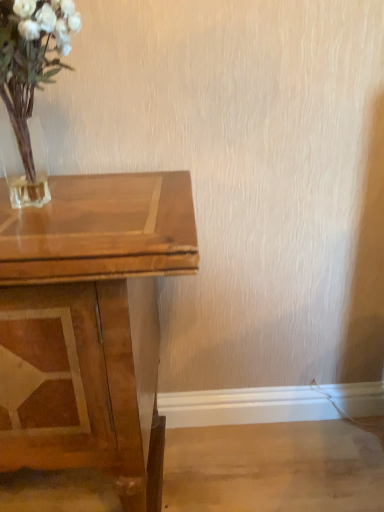
This screenshot has height=512, width=384. I want to click on empty space that is ontop of shiny brown wooden table at left (from a real-world perspective), so click(x=80, y=198).